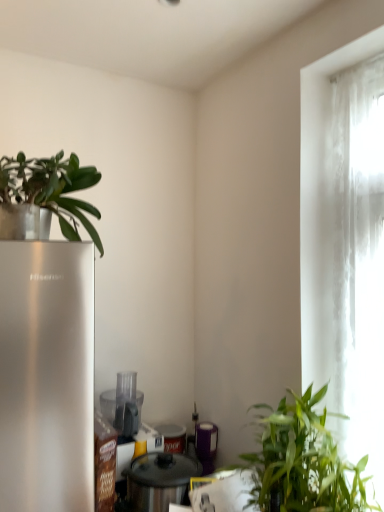
Question: Is translucent fabric curtain at right in front of or behind metallic silver pot at center, the first appliance positioned from the front, in the image?

Choices:
 (A) front
 (B) behind

Answer: (A)

Question: Is point (352, 95) positioned closer to the camera than point (140, 458)?

Choices:
 (A) farther
 (B) closer

Answer: (B)

Question: Which is nearer to the purple matte canister at center, which appears as the third appliance when viewed from the front?

Choices:
 (A) metallic silver pot at center, the third appliance in the back-to-front sequence
 (B) green leafy plant at lower right, arranged as the first houseplant when viewed from the right
 (C) translucent fabric curtain at right
 (D) transparent plastic food processor at center, the 2th appliance positioned from the front
 (E) green matte plant at upper left, which is the 1th houseplant in top-to-bottom order

Answer: (A)

Question: Considering the real-world distances, which object is closest to the transparent plastic food processor at center, the 2th appliance positioned from the front?

Choices:
 (A) purple matte canister at center, positioned as the first appliance in back-to-front order
 (B) metallic silver pot at center, the first appliance positioned from the front
 (C) translucent fabric curtain at right
 (D) green matte plant at upper left, which is the 1th houseplant in top-to-bottom order
 (E) green leafy plant at lower right, which is the first houseplant from bottom to top

Answer: (B)